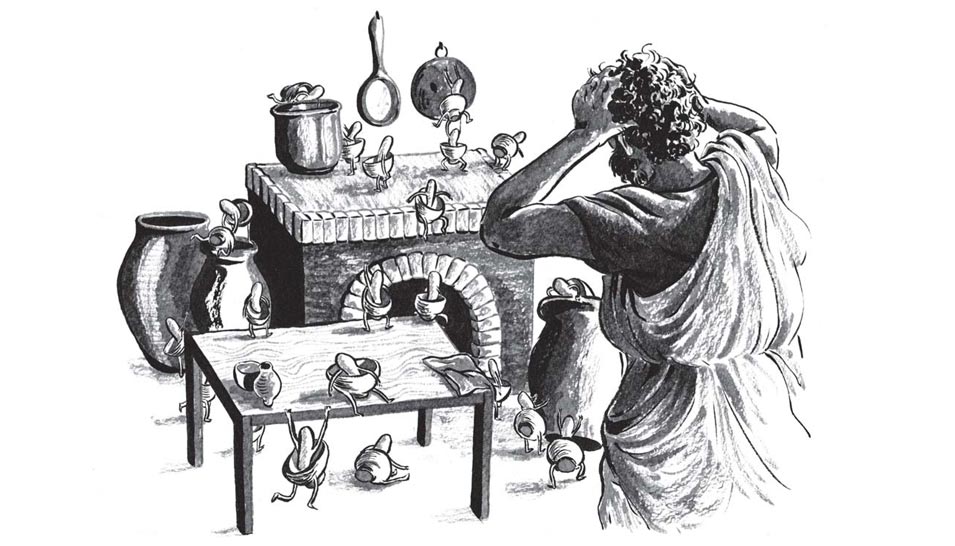
Find the location of `vase`. vase is located at coordinates (323, 130).